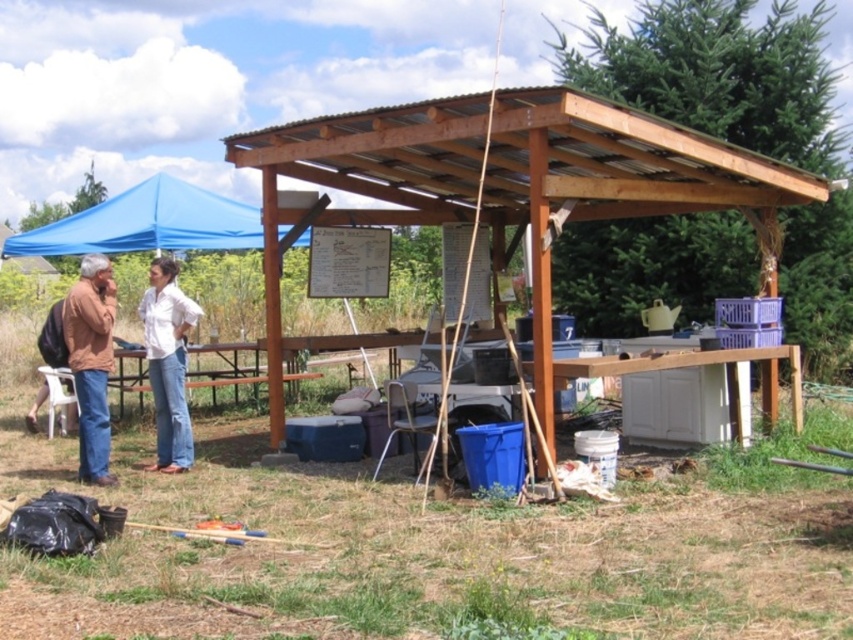
You are planning to set up a new bench under the brown wooden pergola at center and the blue fabric canopy at upper left. Which structure should you choose to ensure the bench fits comfortably without being too cramped?

The brown wooden pergola at center is wider than the blue fabric canopy at upper left, so the bench would fit more comfortably under the brown wooden pergola at center.

You are organizing a community event and need to decide which clothing item to place on a small shelf. Given the white cotton shirt at center and the matte brown jacket at left, which item would fit better on the shelf?

The white cotton shirt at center is smaller than the matte brown jacket at left, so it would fit better on the small shelf.

You are organizing a camping trip and need to pack a bag. You have both the white cotton shirt at center and the matte brown jacket at left. Which item should you choose if you want the thinnest clothing to save space?

The white cotton shirt at center is thinner than the matte brown jacket at left, so you should choose the white cotton shirt at center to save space.